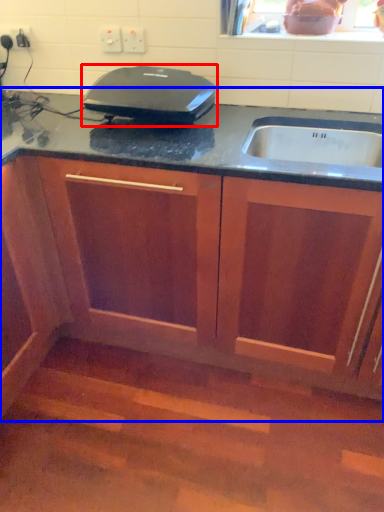
Question: Among these objects, which one is farthest to the camera, home appliance (highlighted by a red box) or cabinetry (highlighted by a blue box)?

Choices:
 (A) home appliance
 (B) cabinetry

Answer: (A)